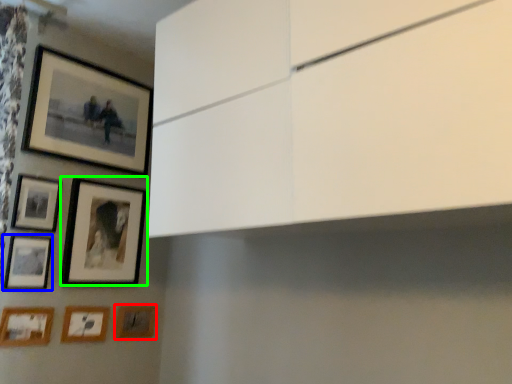
Question: Which object is positioned closest to picture frame (highlighted by a red box)? Select from picture frame (highlighted by a blue box) and picture frame (highlighted by a green box).

Choices:
 (A) picture frame
 (B) picture frame

Answer: (B)